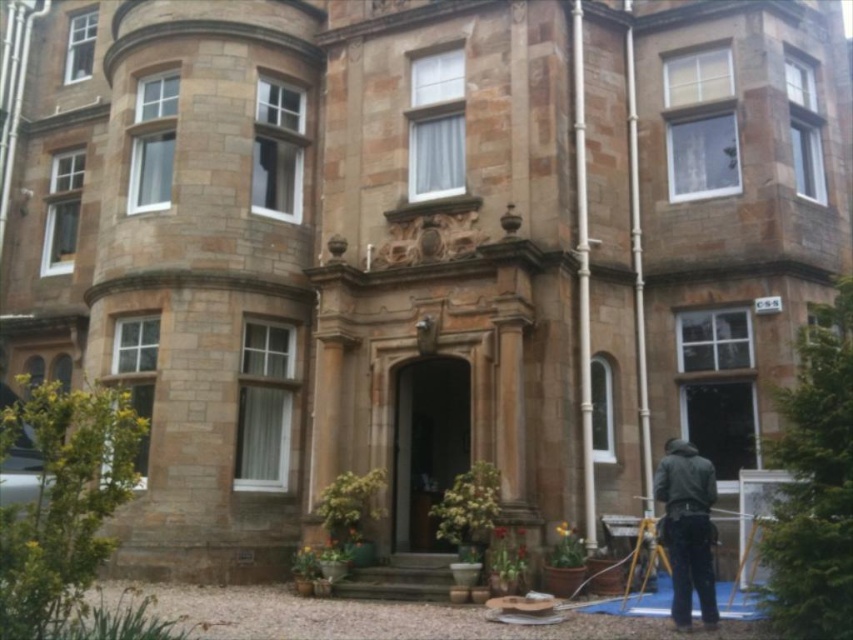
You are standing at the entrance of the grand building and notice a dark gray jacket at lower right. Where exactly is the dark gray jacket positioned relative to the entrance?

The dark gray jacket at lower right is located at point (688, 529) relative to the entrance, which means it is positioned to the right and slightly below the entrance area.

You are a photographer planning to set up your equipment near the entrance of the grand building. You have a dark gray jacket at lower right and a yellow metallic tripod at lower right. If you want to place both items without blocking the entrance, which item should you position closer to the entrance to ensure there is enough space?

The dark gray jacket at lower right might be wider than the yellow metallic tripod at lower right, so positioning the tripod closer to the entrance would leave more space for the jacket without blocking the entrance.

Consider the image. You are a photographer standing at the entrance of the grand building. You notice a dark gray jacket at lower right and a yellow metallic tripod at lower right. Which object is closer to you, the photographer?

The dark gray jacket at lower right is positioned over the yellow metallic tripod at lower right, meaning it is closer to you.